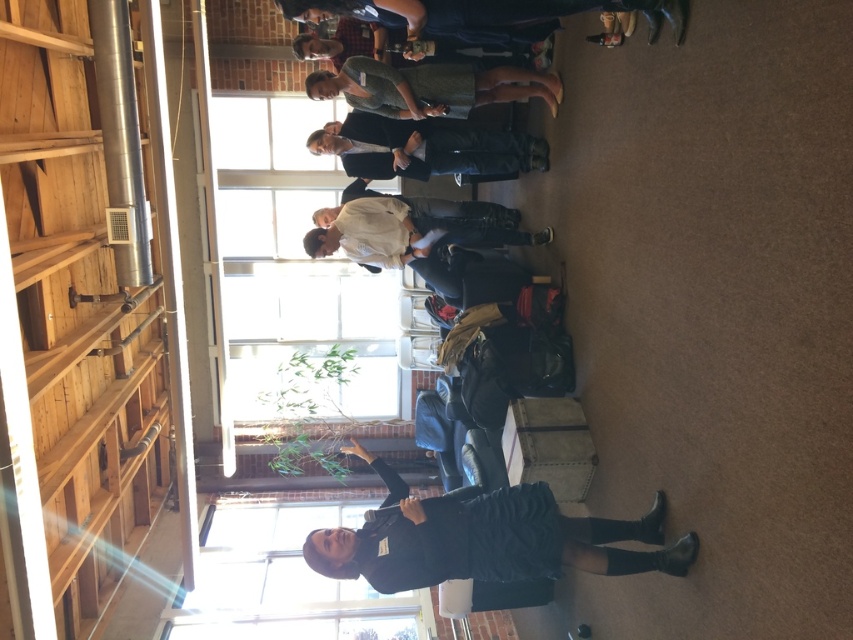
Question: Is black textured dress at center further to the viewer compared to white cotton shirt at center?

Choices:
 (A) no
 (B) yes

Answer: (A)

Question: Does dark gray suit at center come in front of green textured dress at upper center?

Choices:
 (A) no
 (B) yes

Answer: (A)

Question: Which of the following is the closest to the observer?

Choices:
 (A) tap(477, 84)
 (B) tap(323, 227)

Answer: (A)

Question: Does black textured dress at center appear under white cotton shirt at center?

Choices:
 (A) no
 (B) yes

Answer: (B)

Question: Which of the following is the farthest from the observer?

Choices:
 (A) white cotton shirt at center
 (B) black textured dress at center
 (C) dark gray suit at center
 (D) green textured dress at upper center

Answer: (C)

Question: Which point is closer to the camera?

Choices:
 (A) (517, 99)
 (B) (343, 157)

Answer: (A)